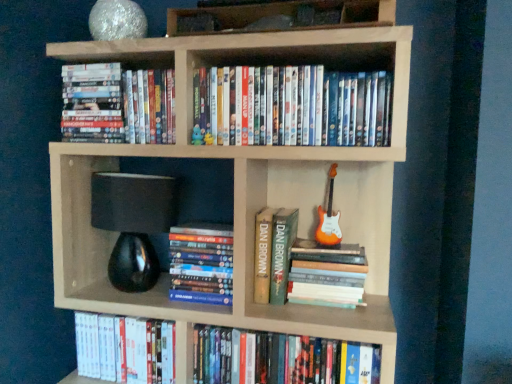
Question: Does matte blue plush toy at upper center contain white glossy dvd at lower left, which is counted as the second book, starting from the bottom?

Choices:
 (A) no
 (B) yes

Answer: (A)

Question: Is matte blue plush toy at upper center not inside white glossy dvd at lower left, which appears as the 6th book when viewed from the top?

Choices:
 (A) yes
 (B) no

Answer: (A)

Question: Is matte blue plush toy at upper center smaller than white glossy dvd at lower left, which appears as the 6th book when viewed from the top?

Choices:
 (A) no
 (B) yes

Answer: (B)

Question: From the image's perspective, does matte blue plush toy at upper center appear lower than white glossy dvd at lower left, which appears as the 6th book when viewed from the top?

Choices:
 (A) no
 (B) yes

Answer: (A)

Question: Considering the relative sizes of matte blue plush toy at upper center and white glossy dvd at lower left, which appears as the 6th book when viewed from the top, in the image provided, is matte blue plush toy at upper center taller than white glossy dvd at lower left, which appears as the 6th book when viewed from the top,?

Choices:
 (A) yes
 (B) no

Answer: (B)

Question: Does matte blue plush toy at upper center turn towards white glossy dvd at lower left, which appears as the 6th book when viewed from the top?

Choices:
 (A) yes
 (B) no

Answer: (B)

Question: Is green hardcover book at center, which appears as the fifth book when ordered from the bottom, positioned with its back to orange glossy electric guitar at right?

Choices:
 (A) yes
 (B) no

Answer: (B)

Question: Considering the relative sizes of green hardcover book at center, acting as the 3th book starting from the top, and orange glossy electric guitar at right in the image provided, is green hardcover book at center, acting as the 3th book starting from the top, thinner than orange glossy electric guitar at right?

Choices:
 (A) yes
 (B) no

Answer: (B)

Question: Is green hardcover book at center, acting as the 3th book starting from the top, oriented towards orange glossy electric guitar at right?

Choices:
 (A) yes
 (B) no

Answer: (B)

Question: Is green hardcover book at center, acting as the 3th book starting from the top, surrounding orange glossy electric guitar at right?

Choices:
 (A) no
 (B) yes

Answer: (A)

Question: Are green hardcover book at center, acting as the 3th book starting from the top, and orange glossy electric guitar at right beside each other?

Choices:
 (A) yes
 (B) no

Answer: (B)

Question: From a real-world perspective, is green hardcover book at center, acting as the 3th book starting from the top, beneath orange glossy electric guitar at right?

Choices:
 (A) yes
 (B) no

Answer: (A)

Question: Is matte blue plush toy at upper center with wooden books at upper center?

Choices:
 (A) yes
 (B) no

Answer: (B)